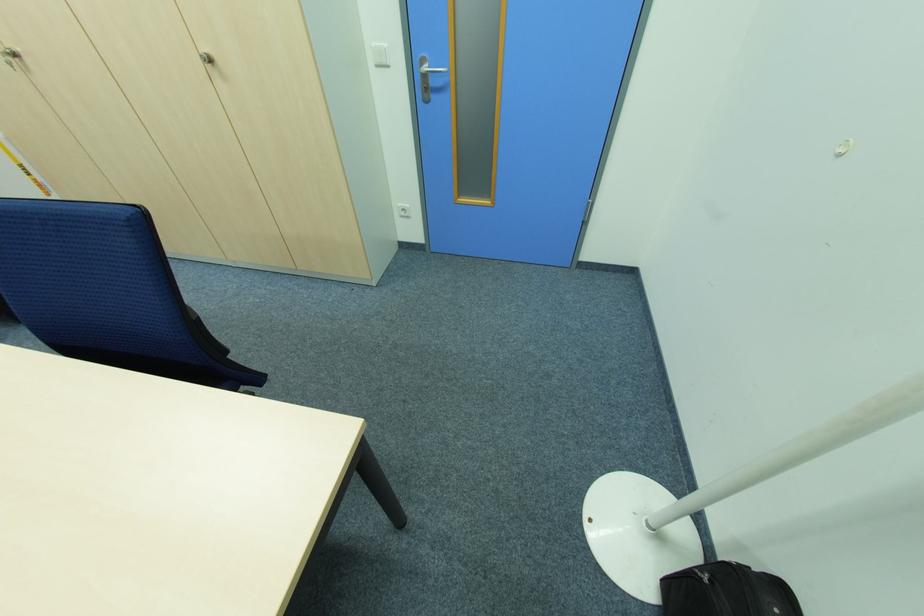
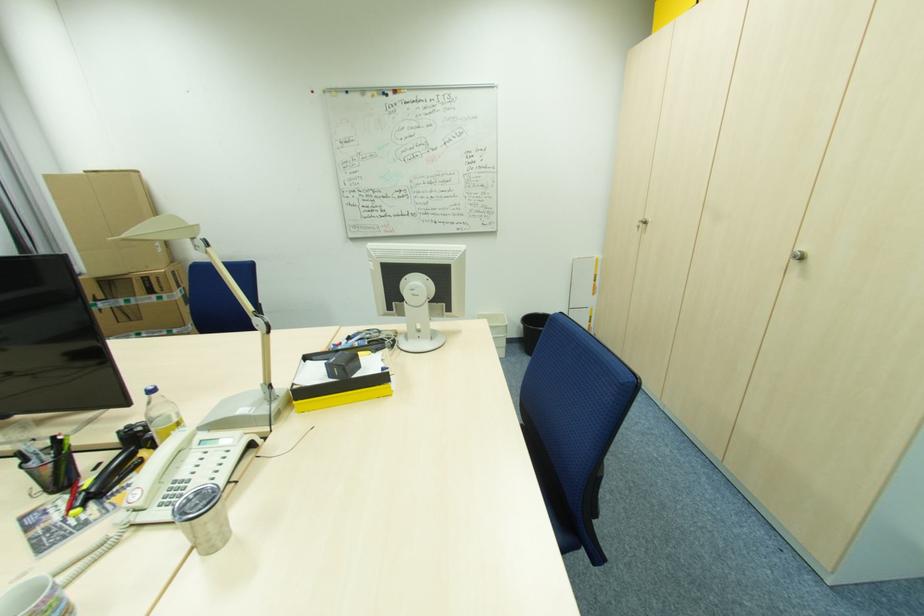
Question: Based on the continuous images, in which direction is the camera rotating? Reply with the corresponding letter.

Choices:
 (A) Left
 (B) Right
 (C) Up
 (D) Down

Answer: (A)